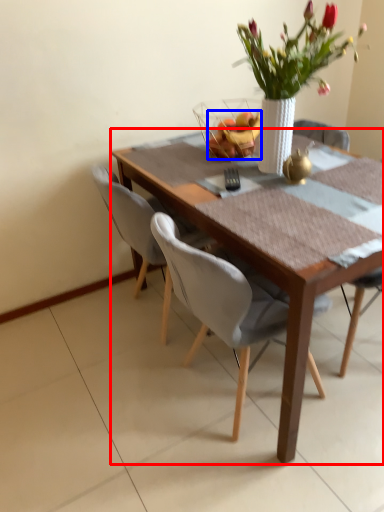
Question: Which object is further to the camera taking this photo, kitchen & dining room table (highlighted by a red box) or fruit (highlighted by a blue box)?

Choices:
 (A) kitchen & dining room table
 (B) fruit

Answer: (B)